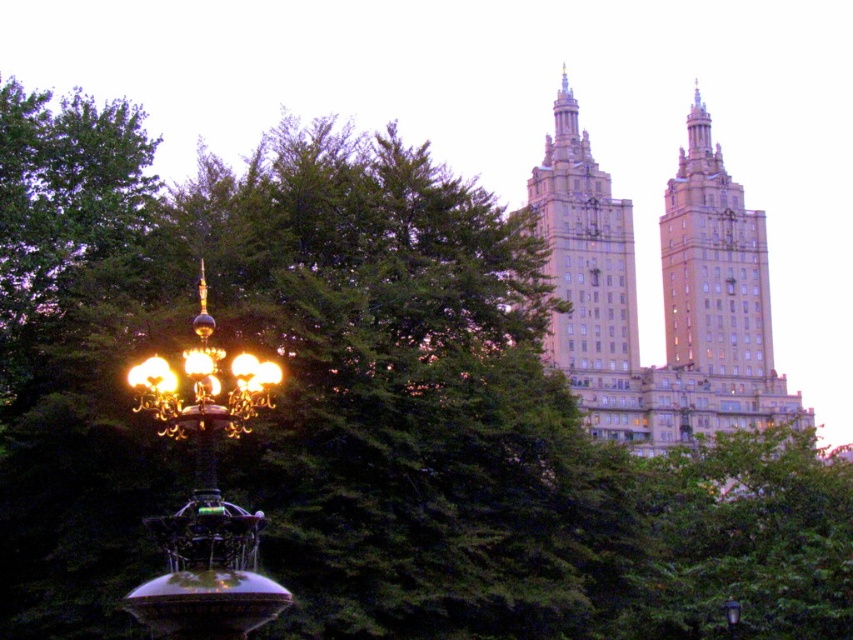
You are standing in the middle of the park and see the beige stone building at upper right. What is its exact 2D coordinate location?

The beige stone building at upper right is located at coordinates (662,294).

You are an architect analyzing the urban layout. You observe the beige stone building at upper right and the brown stone building at upper center. Which building is located to the left of the other?

The beige stone building at upper right is positioned on the left side of brown stone building at upper center, meaning it is to the left of the brown stone building at upper center.